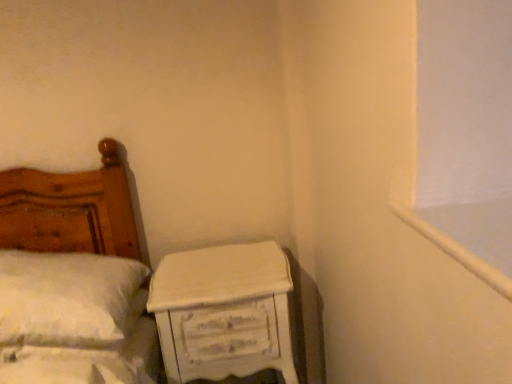
Image resolution: width=512 pixels, height=384 pixels. Identify the location of white painted wood at upper right. click(x=455, y=250).

Locate an element on the screen. Image resolution: width=512 pixels, height=384 pixels. white distressed wood nightstand at lower right is located at coordinates (224, 312).

This screenshot has width=512, height=384. Find the location of `white fluffy pillow at left`. white fluffy pillow at left is located at coordinates (69, 299).

This screenshot has height=384, width=512. I want to click on white painted wood at upper right, so click(x=455, y=250).

Would you say white fluffy pillow at left is inside or outside white painted wood at upper right?

white fluffy pillow at left exists outside the volume of white painted wood at upper right.

Is point (79, 312) less distant than point (505, 297)?

No, it is behind (505, 297).

In the image, there is a white painted wood at upper right. Where is `pillow below it (from a real-world perspective)`? The width and height of the screenshot is (512, 384). pillow below it (from a real-world perspective) is located at coordinates (69, 299).

Who is more distant, white fluffy pillow at left or white painted wood at upper right?

white fluffy pillow at left is behind.

From the picture: From a real-world perspective, is white distressed wood nightstand at lower right physically located above or below white fluffy pillow at left?

Clearly, from a real-world perspective, white distressed wood nightstand at lower right is below white fluffy pillow at left.

Considering the relative positions of white distressed wood nightstand at lower right and white fluffy pillow at left in the image provided, is white distressed wood nightstand at lower right to the left or to the right of white fluffy pillow at left?

white distressed wood nightstand at lower right is positioned on white fluffy pillow at left's right side.

In order to click on nightstand located below the white fluffy pillow at left (from the image's perspective) in this screenshot , I will do `click(224, 312)`.

Would you say white distressed wood nightstand at lower right contains white painted wood at upper right?

No, white painted wood at upper right is not a part of white distressed wood nightstand at lower right.

Considering the sizes of white distressed wood nightstand at lower right and white painted wood at upper right in the image, is white distressed wood nightstand at lower right bigger or smaller than white painted wood at upper right?

In the image, white distressed wood nightstand at lower right appears to be larger than white painted wood at upper right.

Is white distressed wood nightstand at lower right oriented away from white painted wood at upper right?

No, white distressed wood nightstand at lower right is not facing away from white painted wood at upper right.

Considering the positions of objects white distressed wood nightstand at lower right and white painted wood at upper right in the image provided, who is behind, white distressed wood nightstand at lower right or white painted wood at upper right?

white distressed wood nightstand at lower right is further away from the camera.

Considering the positions of point (493, 273) and point (2, 326), is point (493, 273) closer or farther from the camera than point (2, 326)?

Point (493, 273).

Looking at this image, is white painted wood at upper right with white fluffy pillow at left?

white painted wood at upper right and white fluffy pillow at left are not in contact.

Can you confirm if white painted wood at upper right is taller than white fluffy pillow at left?

In fact, white painted wood at upper right may be shorter than white fluffy pillow at left.

Considering the sizes of objects white painted wood at upper right and white distressed wood nightstand at lower right in the image provided, who is taller, white painted wood at upper right or white distressed wood nightstand at lower right?

white distressed wood nightstand at lower right.

From a real-world perspective, which is physically above, white painted wood at upper right or white distressed wood nightstand at lower right?

white painted wood at upper right, from a real-world perspective.

Considering the positions of objects white painted wood at upper right and white distressed wood nightstand at lower right in the image provided, who is more to the left, white painted wood at upper right or white distressed wood nightstand at lower right?

white distressed wood nightstand at lower right.

Does white fluffy pillow at left have a lesser height compared to white distressed wood nightstand at lower right?

Yes, white fluffy pillow at left is shorter than white distressed wood nightstand at lower right.

Is white fluffy pillow at left oriented away from white distressed wood nightstand at lower right?

white fluffy pillow at left does not have its back to white distressed wood nightstand at lower right.

From the image's perspective, is white fluffy pillow at left on white distressed wood nightstand at lower right?

Yes, from the image's perspective, white fluffy pillow at left is over white distressed wood nightstand at lower right.

At what (x,y) coordinates should I click in order to perform the action: click on window frame above the white fluffy pillow at left (from the image's perspective). Please return your answer as a coordinate pair (x, y). The height and width of the screenshot is (384, 512). Looking at the image, I should click on (455, 250).

Where is `pillow that appears in front of the white distressed wood nightstand at lower right`? This screenshot has width=512, height=384. pillow that appears in front of the white distressed wood nightstand at lower right is located at coordinates 69,299.

Based on their spatial positions, is white fluffy pillow at left or white painted wood at upper right closer to white distressed wood nightstand at lower right?

The object closer to white distressed wood nightstand at lower right is white fluffy pillow at left.

Which object lies nearer to the anchor point white fluffy pillow at left, white painted wood at upper right or white distressed wood nightstand at lower right?

Based on the image, white distressed wood nightstand at lower right appears to be nearer to white fluffy pillow at left.

When comparing their distances from white painted wood at upper right, does white fluffy pillow at left or white distressed wood nightstand at lower right seem further?

white fluffy pillow at left.

Considering their positions, is white distressed wood nightstand at lower right positioned closer to white painted wood at upper right than white fluffy pillow at left?

white distressed wood nightstand at lower right lies closer to white painted wood at upper right than the other object.

From the image, which object appears to be nearer to white fluffy pillow at left, white distressed wood nightstand at lower right or white painted wood at upper right?

Based on the image, white distressed wood nightstand at lower right appears to be nearer to white fluffy pillow at left.

From the image, which object appears to be nearer to white distressed wood nightstand at lower right, white painted wood at upper right or white fluffy pillow at left?

Among the two, white fluffy pillow at left is located nearer to white distressed wood nightstand at lower right.

Locate an element on the screen. This screenshot has height=384, width=512. nightstand between white fluffy pillow at left and white painted wood at upper right in the horizontal direction is located at coordinates (224, 312).